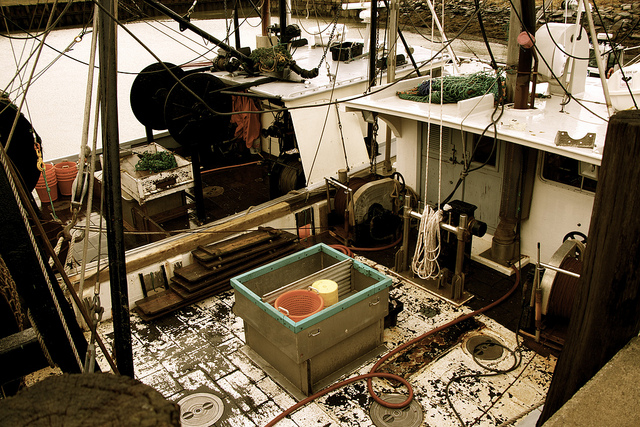
What are the coordinates of `cloth` in the screenshot? It's located at (243, 124).